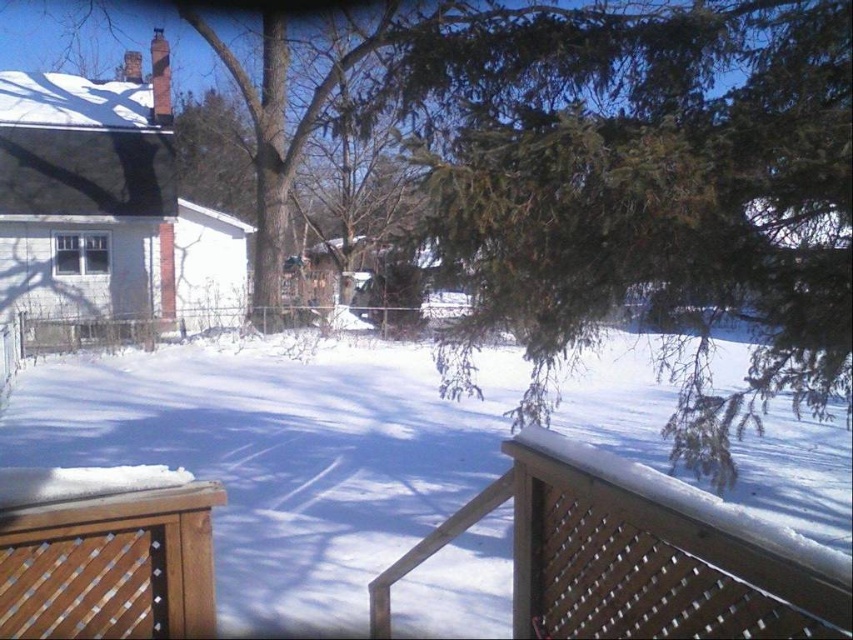
Question: Which object appears farthest from the camera in this image?

Choices:
 (A) green needle-like at upper right
 (B) wooden deck at center

Answer: (A)

Question: Among these objects, which one is nearest to the camera?

Choices:
 (A) brown wooden deck at lower left
 (B) wooden deck at center
 (C) green needle-like at upper right

Answer: (B)

Question: Is the position of wooden deck at center less distant than that of brown wooden deck at lower left?

Choices:
 (A) yes
 (B) no

Answer: (A)

Question: Does wooden deck at center appear on the right side of brown wooden deck at lower left?

Choices:
 (A) no
 (B) yes

Answer: (B)

Question: Based on their relative distances, which object is nearer to the brown wooden deck at lower left?

Choices:
 (A) wooden deck at center
 (B) green needle-like at upper right

Answer: (A)

Question: Does green needle-like at upper right appear on the left side of wooden deck at center?

Choices:
 (A) no
 (B) yes

Answer: (A)